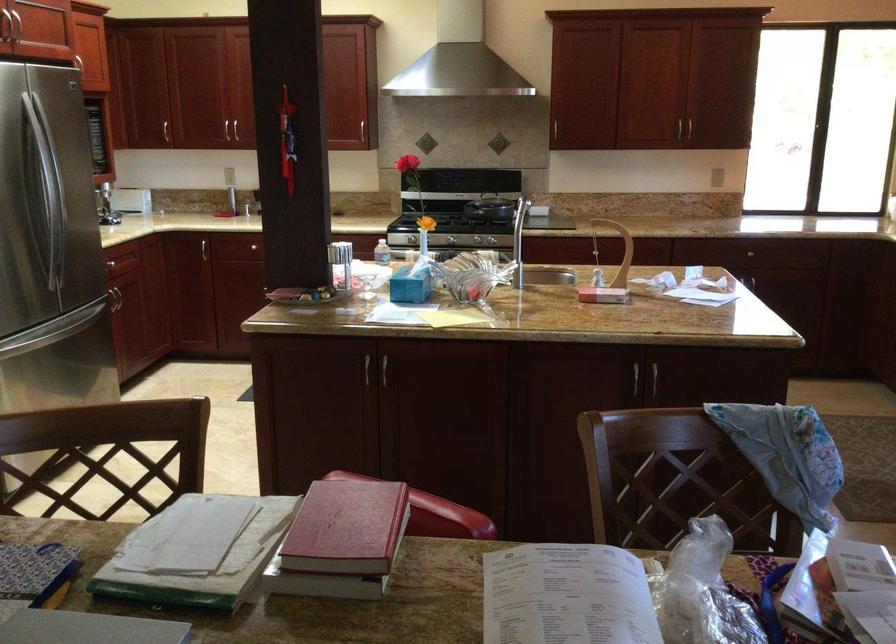
The location [341,260] corresponds to which object?

This point indicates the white spray can.